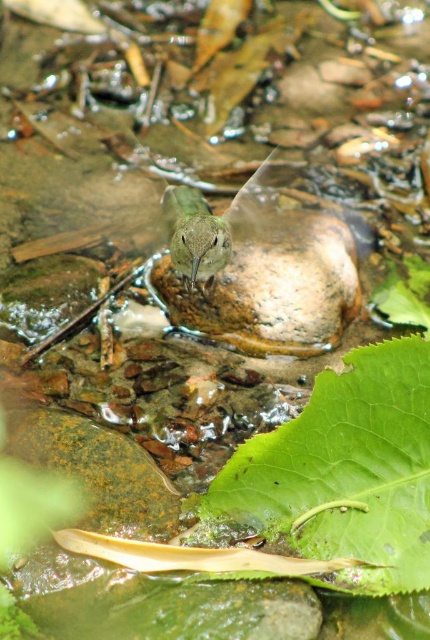
Question: Where is green matte leaf at lower center located in relation to green matte bird at center in the image?

Choices:
 (A) right
 (B) left

Answer: (A)

Question: Which of the following is the farthest from the observer?

Choices:
 (A) (350, 412)
 (B) (260, 172)

Answer: (B)

Question: Which point is farther to the camera?

Choices:
 (A) green matte leaf at lower center
 (B) green matte bird at center

Answer: (B)

Question: From the image, what is the correct spatial relationship of green matte leaf at lower center in relation to green matte bird at center?

Choices:
 (A) right
 (B) left

Answer: (A)

Question: Does green matte leaf at lower center appear over green matte bird at center?

Choices:
 (A) no
 (B) yes

Answer: (A)